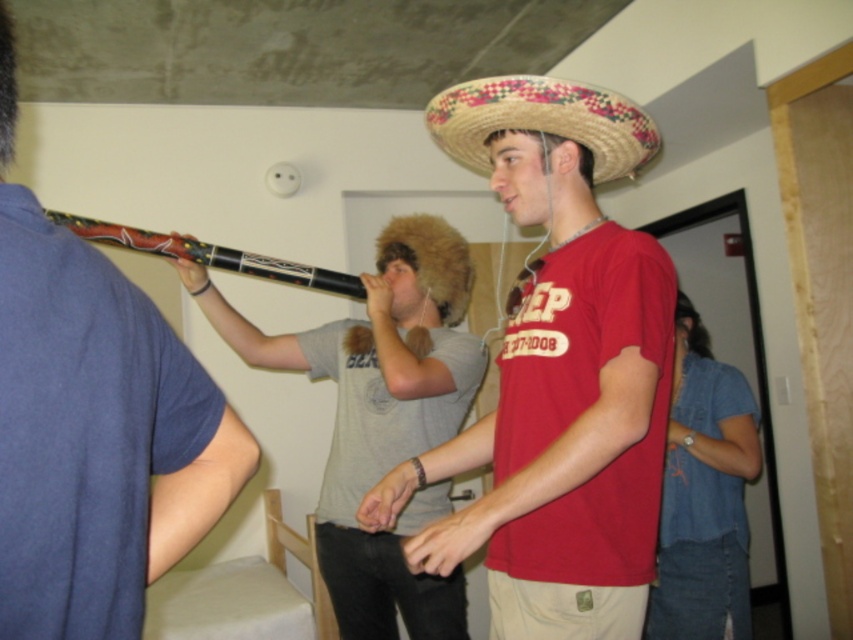
Which of these two, matte straw sombrero at center or gray fur hat at center, stands shorter?

matte straw sombrero at center

Who is more forward, (653, 300) or (412, 323)?

Point (653, 300) is in front.

This screenshot has height=640, width=853. In order to click on matte straw sombrero at center in this screenshot , I will do `click(558, 372)`.

Is matte black flute at upper left bigger than gray fur hat at center?

No, matte black flute at upper left is not bigger than gray fur hat at center.

Who is positioned more to the right, matte black flute at upper left or gray fur hat at center?

gray fur hat at center

Does point (28, 440) come closer to viewer compared to point (360, 577)?

Yes, point (28, 440) is closer to viewer.

Locate an element on the screen. Image resolution: width=853 pixels, height=640 pixels. matte black flute at upper left is located at coordinates (93, 426).

From the picture: How much distance is there between matte straw sombrero at center and matte black flute at upper left?

matte straw sombrero at center and matte black flute at upper left are 21.53 inches apart.

Can you confirm if matte straw sombrero at center is positioned above matte black flute at upper left?

Actually, matte straw sombrero at center is below matte black flute at upper left.

What do you see at coordinates (558, 372) in the screenshot? I see `matte straw sombrero at center` at bounding box center [558, 372].

Where is `matte straw sombrero at center`? matte straw sombrero at center is located at coordinates (558, 372).